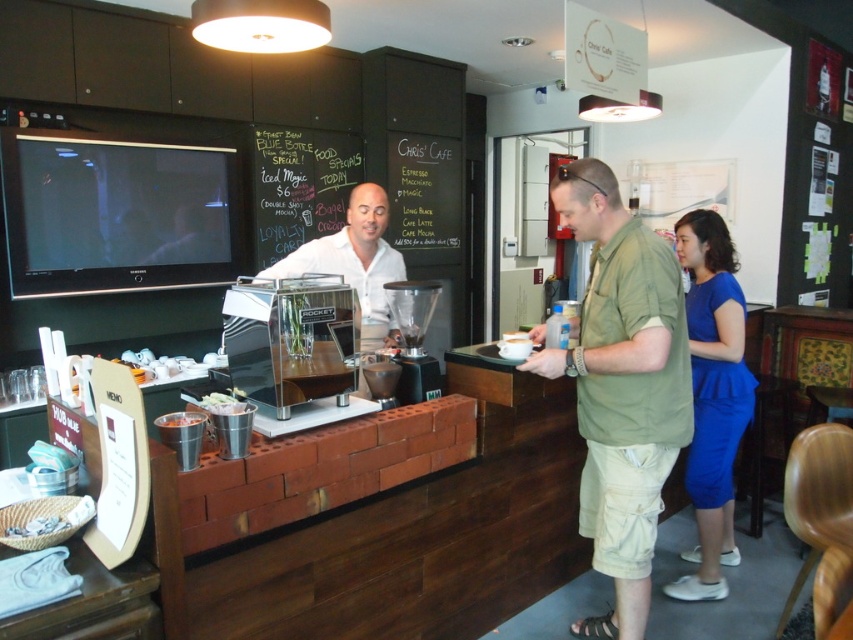
Question: Does green cotton shirt at right have a greater width compared to black chalkboard at upper center?

Choices:
 (A) yes
 (B) no

Answer: (B)

Question: Which point appears closest to the camera in this image?

Choices:
 (A) (695, 353)
 (B) (648, 296)
 (C) (399, 296)
 (D) (323, 132)

Answer: (B)

Question: Considering the real-world distances, which object is farthest from the blue satin dress at lower right?

Choices:
 (A) black chalkboard at upper center
 (B) metallic silver coffee machine at center

Answer: (A)

Question: Does green cotton shirt at right have a greater width compared to blue satin dress at lower right?

Choices:
 (A) yes
 (B) no

Answer: (A)

Question: Which of the following is the farthest from the observer?

Choices:
 (A) (709, 412)
 (B) (437, 380)
 (C) (611, 188)
 (D) (308, 224)

Answer: (D)

Question: Does black chalkboard at upper center appear on the left side of metallic silver coffee machine at center?

Choices:
 (A) no
 (B) yes

Answer: (B)